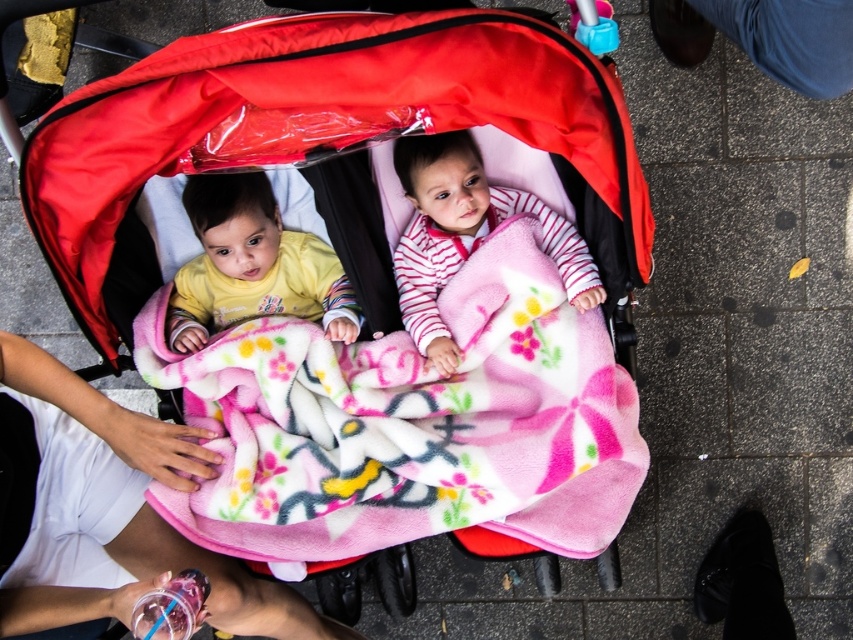
You are a parent trying to ensure the babies are covered properly. Which blanket, the matte pink blanket at center or the fluffy pink blanket at center, is on top to provide immediate coverage?

The matte pink blanket at center is positioned over the fluffy pink blanket at center, so the matte pink blanket at center is on top and provides immediate coverage.

You are a photographer trying to capture a photo of the two babies in the stroller. You notice the white fabric hand at lower left is partially blocking the view. Can you move the hand to the side without disturbing the fluffy pink blanket at center? Explain why or why not based on their sizes.

The fluffy pink blanket at center is wider than the white fabric hand at lower left. Since the blanket is wider, moving the hand might not disturb it as the hand is narrower and can be moved aside without affecting the blanket.